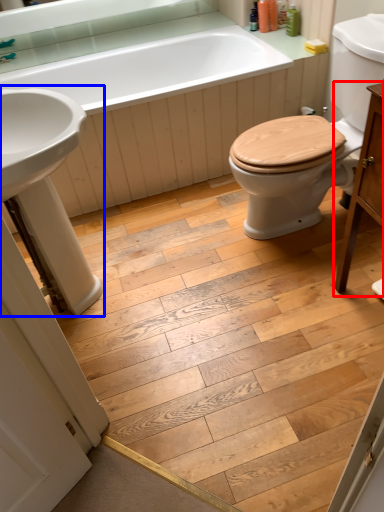
Question: Which object is closer to the camera taking this photo, vanity (highlighted by a red box) or sink (highlighted by a blue box)?

Choices:
 (A) vanity
 (B) sink

Answer: (A)